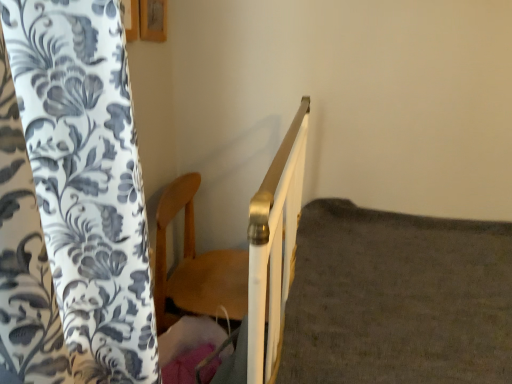
Find the location of `wooden chair at center`. wooden chair at center is located at coordinates (196, 265).

The width and height of the screenshot is (512, 384). What do you see at coordinates (196, 265) in the screenshot? I see `wooden chair at center` at bounding box center [196, 265].

Locate an element on the screen. The width and height of the screenshot is (512, 384). white matte bed frame at upper right is located at coordinates (274, 250).

What do you see at coordinates (274, 250) in the screenshot? This screenshot has width=512, height=384. I see `white matte bed frame at upper right` at bounding box center [274, 250].

This screenshot has height=384, width=512. I want to click on wooden chair at center, so click(x=196, y=265).

Based on their positions, is white matte bed frame at upper right located to the left or right of wooden chair at center?

Based on their positions, white matte bed frame at upper right is located to the right of wooden chair at center.

Considering the positions of objects white matte bed frame at upper right and wooden chair at center in the image provided, who is in front, white matte bed frame at upper right or wooden chair at center?

white matte bed frame at upper right is closer to the camera.

Which is behind, point (281, 240) or point (210, 285)?

The point (210, 285) is farther.

From the image's perspective, who appears lower, white matte bed frame at upper right or wooden chair at center?

From the image's view, white matte bed frame at upper right is below.

From a real-world perspective, is white matte bed frame at upper right on wooden chair at center?

Yes, from a real-world perspective, white matte bed frame at upper right is above wooden chair at center.

Is white matte bed frame at upper right wider or thinner than wooden chair at center?

Clearly, white matte bed frame at upper right has more width compared to wooden chair at center.

Between white matte bed frame at upper right and wooden chair at center, which one has less height?

wooden chair at center.

Is white matte bed frame at upper right bigger than wooden chair at center?

Yes, white matte bed frame at upper right is bigger than wooden chair at center.

Is white matte bed frame at upper right inside the boundaries of wooden chair at center, or outside?

white matte bed frame at upper right is located beyond the bounds of wooden chair at center.

Is white matte bed frame at upper right far away from wooden chair at center?

No.

Does white matte bed frame at upper right turn towards wooden chair at center?

No, white matte bed frame at upper right is not aimed at wooden chair at center.

How different are the orientations of white matte bed frame at upper right and wooden chair at center in degrees?

The angular difference between white matte bed frame at upper right and wooden chair at center is 86.9 degrees.

At what (x,y) coordinates should I click in order to perform the action: click on bed frame in front of the wooden chair at center. Please return your answer as a coordinate pair (x, y). Image resolution: width=512 pixels, height=384 pixels. Looking at the image, I should click on (274, 250).

Which is more to the left, wooden chair at center or white matte bed frame at upper right?

From the viewer's perspective, wooden chair at center appears more on the left side.

Considering the relative positions of wooden chair at center and white matte bed frame at upper right in the image provided, is wooden chair at center in front of white matte bed frame at upper right?

That is False.

Is point (233, 313) closer to camera compared to point (258, 305)?

No, (233, 313) is behind (258, 305).

From the image's perspective, which is above, wooden chair at center or white matte bed frame at upper right?

From the image's view, wooden chair at center is above.

From a real-world perspective, is wooden chair at center beneath white matte bed frame at upper right?

Yes, from a real-world perspective, wooden chair at center is under white matte bed frame at upper right.

Considering the sizes of objects wooden chair at center and white matte bed frame at upper right in the image provided, who is thinner, wooden chair at center or white matte bed frame at upper right?

wooden chair at center is thinner.

Considering the sizes of objects wooden chair at center and white matte bed frame at upper right in the image provided, who is taller, wooden chair at center or white matte bed frame at upper right?

white matte bed frame at upper right.

Is wooden chair at center smaller than white matte bed frame at upper right?

Yes, wooden chair at center is smaller than white matte bed frame at upper right.

In the scene shown: Is wooden chair at center surrounding white matte bed frame at upper right?

Actually, white matte bed frame at upper right is outside wooden chair at center.

Is wooden chair at center far away from white matte bed frame at upper right?

No, there isn't a large distance between wooden chair at center and white matte bed frame at upper right.

Is wooden chair at center oriented towards white matte bed frame at upper right?

Yes, wooden chair at center is aimed at white matte bed frame at upper right.

Can you tell me how much wooden chair at center and white matte bed frame at upper right differ in facing direction?

There is a 86.9-degree angle between the facing directions of wooden chair at center and white matte bed frame at upper right.

You are a GUI agent. You are given a task and a screenshot of the screen. Output one action in this format:
    pyautogui.click(x=<x>, y=<y>)
    Task: Click on the furniture behind the white matte bed frame at upper right
    The height and width of the screenshot is (384, 512).
    Given the screenshot: What is the action you would take?
    pyautogui.click(x=196, y=265)

Where is `furniture behind the white matte bed frame at upper right`? The height and width of the screenshot is (384, 512). furniture behind the white matte bed frame at upper right is located at coordinates (196, 265).

Find the location of a particular element. Image resolution: width=512 pixels, height=384 pixels. furniture below the white matte bed frame at upper right (from a real-world perspective) is located at coordinates tap(196, 265).